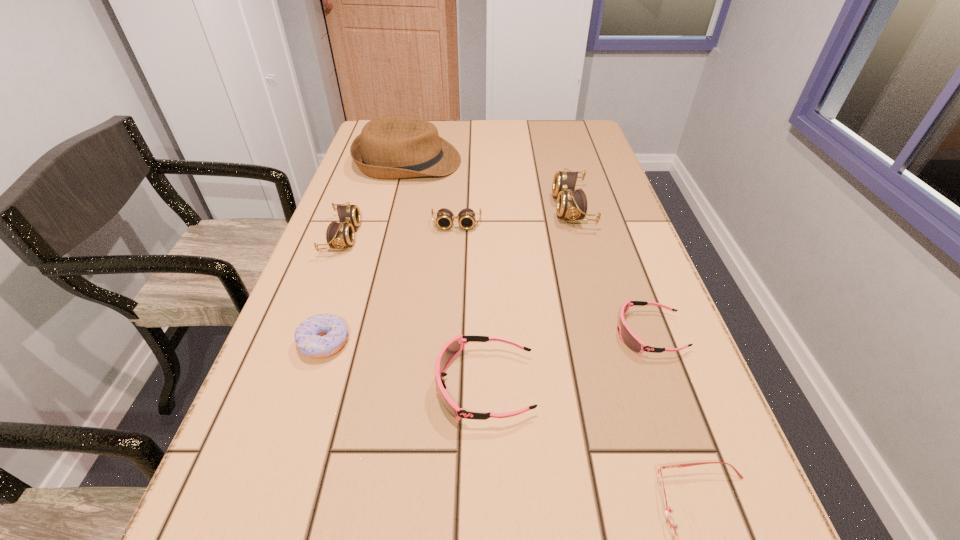
Where is `vacant area that lies between the second brown goggles from right to left and the doughnut`? The image size is (960, 540). vacant area that lies between the second brown goggles from right to left and the doughnut is located at coordinates (390, 284).

Image resolution: width=960 pixels, height=540 pixels. In order to click on object that is the sixth closest to the bigger pink goggles in this screenshot , I will do `click(571, 203)`.

I want to click on object that stands as the fifth closest to the shortest goggles, so [x=323, y=335].

Identify which goggles is the nearest to the second tallest object. Please provide its 2D coordinates. Your answer should be formatted as a tuple, i.e. [(x, y)], where the tuple contains the x and y coordinates of a point satisfying the conditions above.

[(466, 218)]

The width and height of the screenshot is (960, 540). What are the coordinates of `goggles that is the third closest to the smallest brown goggles` in the screenshot? It's located at (452, 348).

Where is `brown goggles identified as the closest to the left pink goggles`? The height and width of the screenshot is (540, 960). brown goggles identified as the closest to the left pink goggles is located at coordinates (338, 235).

Locate an element on the screen. The height and width of the screenshot is (540, 960). brown goggles that stands as the second closest to the doughnut is located at coordinates (466, 218).

The width and height of the screenshot is (960, 540). In order to click on vacant space that satisfies the following two spatial constraints: 1. through the lenses of the second biggest brown goggles; 2. on the left side of the brown doughnut in this screenshot , I will do `click(303, 343)`.